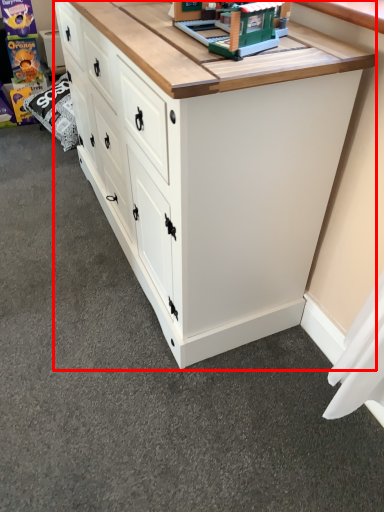
Question: Where is chest of drawers (annotated by the red box) located in relation to toy in the image?

Choices:
 (A) right
 (B) left

Answer: (B)